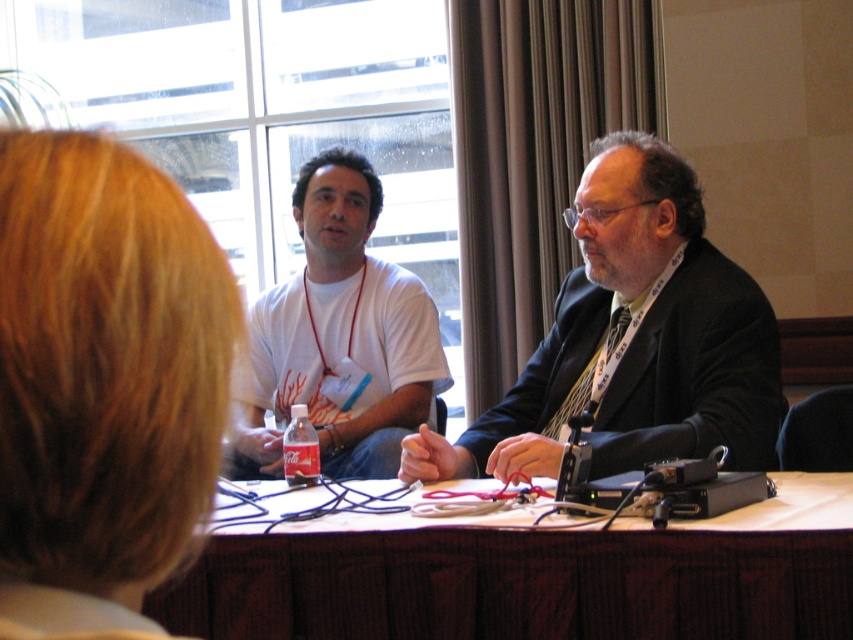
Question: Does blonde hair at upper left have a greater width compared to wooden table at center?

Choices:
 (A) no
 (B) yes

Answer: (A)

Question: Estimate the real-world distances between objects in this image. Which object is closer to the blonde hair at upper left?

Choices:
 (A) dark suit at center
 (B) wooden table at center

Answer: (B)

Question: Is dark suit at center wider than white t-shirt at center?

Choices:
 (A) no
 (B) yes

Answer: (B)

Question: Which point is farther to the camera?

Choices:
 (A) wooden table at center
 (B) white t-shirt at center
 (C) dark suit at center
 (D) blonde hair at upper left

Answer: (B)

Question: Which point is closer to the camera taking this photo?

Choices:
 (A) (271, 589)
 (B) (599, 428)

Answer: (A)

Question: Where is wooden table at center located in relation to white t-shirt at center in the image?

Choices:
 (A) below
 (B) above

Answer: (A)